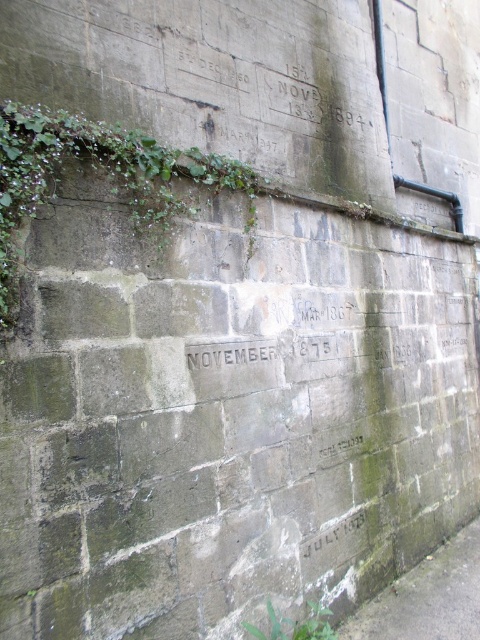
Between point (288, 627) and point (348, 516), which one is positioned in front?

Point (288, 627)

Does green leafy weed at lower center appear on the left side of dark gray stone text at center?

Correct, you'll find green leafy weed at lower center to the left of dark gray stone text at center.

I want to click on green leafy weed at lower center, so click(x=295, y=625).

Does green mossy ivy at upper left appear over dark gray stone text at center?

Indeed, green mossy ivy at upper left is positioned over dark gray stone text at center.

Is green mossy ivy at upper left further to camera compared to dark gray stone text at center?

No, green mossy ivy at upper left is closer to the viewer.

What do you see at coordinates (97, 173) in the screenshot? This screenshot has height=640, width=480. I see `green mossy ivy at upper left` at bounding box center [97, 173].

The image size is (480, 640). Identify the location of green mossy ivy at upper left. (97, 173).

Does green mossy ivy at upper left appear on the left side of green leafy weed at lower center?

Indeed, green mossy ivy at upper left is positioned on the left side of green leafy weed at lower center.

Between point (115, 141) and point (295, 632), which one is positioned in front?

Point (115, 141) is more forward.

At what (x,y) coordinates should I click in order to perform the action: click on green mossy ivy at upper left. Please return your answer as a coordinate pair (x, y). Looking at the image, I should click on (97, 173).